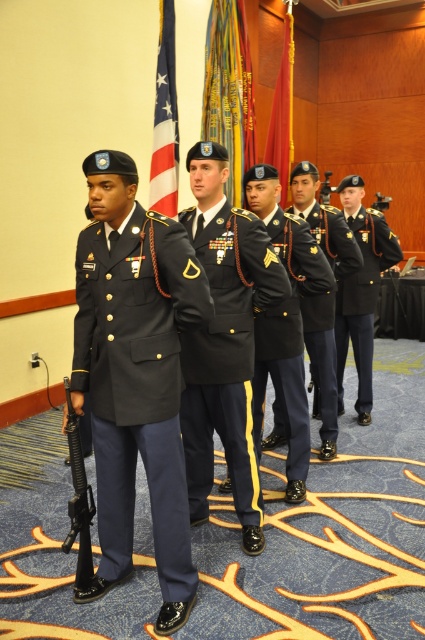
Does navy blue fabric uniform at left have a greater width compared to silk flag at center?

Yes.

Between point (167, 467) and point (215, 99), which one is positioned in front?

Positioned in front is point (167, 467).

Locate an element on the screen. navy blue fabric uniform at left is located at coordinates (138, 384).

Between shiny black uniform at center and red velvet flag at upper center, which one is positioned higher?

red velvet flag at upper center

Does shiny black uniform at center have a smaller size compared to red velvet flag at upper center?

Yes.

The height and width of the screenshot is (640, 425). I want to click on shiny black uniform at center, so click(x=289, y=337).

Can you confirm if matte black uniform at left is smaller than silky cotton flag at center?

Actually, matte black uniform at left might be larger than silky cotton flag at center.

Does matte black uniform at left have a larger size compared to silky cotton flag at center?

Yes, matte black uniform at left is bigger than silky cotton flag at center.

The width and height of the screenshot is (425, 640). What do you see at coordinates (164, 372) in the screenshot?
I see `matte black uniform at left` at bounding box center [164, 372].

The height and width of the screenshot is (640, 425). I want to click on matte black uniform at left, so click(x=164, y=372).